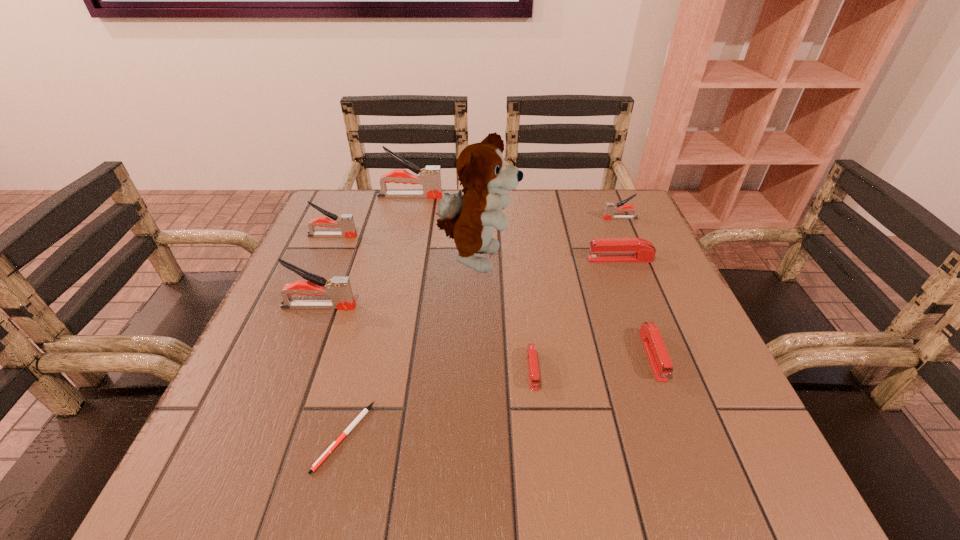
This screenshot has width=960, height=540. In order to click on puppy that is at the far edge in this screenshot , I will do `click(470, 218)`.

The height and width of the screenshot is (540, 960). In order to click on object located in the near edge section of the desktop in this screenshot , I will do `click(365, 411)`.

Find the location of a particular element. This screenshot has height=540, width=960. object located at the far right corner is located at coordinates (610, 208).

Locate an element on the screen. This screenshot has height=540, width=960. vacant region at the far edge of the desktop is located at coordinates (438, 237).

Locate an element on the screen. free space at the near edge is located at coordinates (553, 456).

Find the location of a particular element. free space at the left edge is located at coordinates (358, 242).

This screenshot has height=540, width=960. I want to click on free region at the right edge of the desktop, so click(661, 265).

Find the location of a particular element. free space at the far left corner of the desktop is located at coordinates (343, 207).

Find the location of `vacant point at the far right corner`. vacant point at the far right corner is located at coordinates (602, 231).

Locate an element on the screen. free space at the near right corner of the desktop is located at coordinates (776, 478).